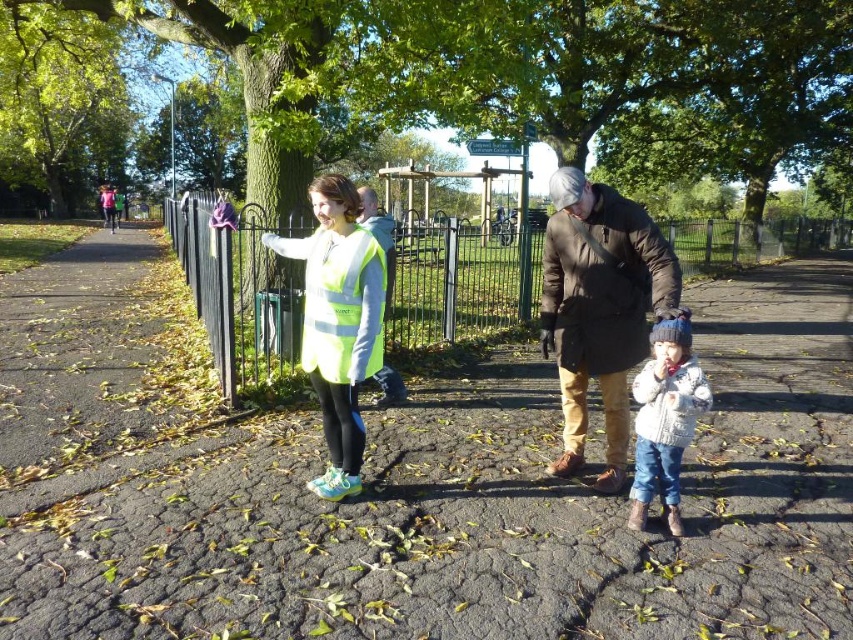
You are a pedestrian trying to cross the road in this park area. There is a neon yellow reflective vest at center marked by point (338, 323). Where should you look for the vest?

The neon yellow reflective vest at center is located at the coordinates point (338, 323).

You are standing at point (339, 289) and want to walk to point (614, 440). Which direction should you move in relation to the two points?

You should move towards point (614, 440), which is behind point (339, 289), so you need to walk in the direction away from point (339, 289) to reach it.

You are a pedestrian in the park and see both the neon yellow reflective vest at center and the yellow reflective safety vest at center. Which one is located to the left?

The neon yellow reflective vest at center is positioned on the left side of the yellow reflective vest at center.